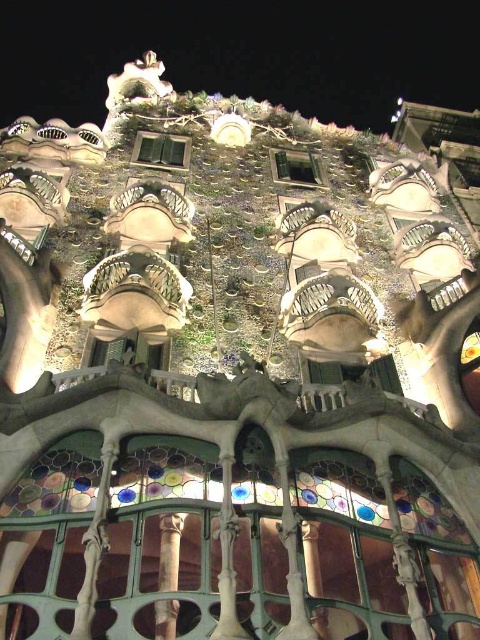
You are a drone operator tasked with capturing aerial footage of the Casa Batll? building. Your drone is currently positioned 100 meters away from the brown wood column at center. Can your drone safely fly towards the clear glass window at upper center without getting too close to the building?

The distance between the brown wood column at center and the clear glass window at upper center is 85.33 meters. Since your drone is currently 100 meters away from the brown wood column at center, it has enough space to safely fly towards the clear glass window at upper center without getting too close to the building.

You are a tourist standing in front of Casa Batll? at night. You want to take a photo of the matte glass window at center. Where should you aim your camera to capture it?

You should aim your camera at point (160, 150) to capture the matte glass window at center.

Looking at this image, you are standing in front of Casa Batll? looking up at the upper portion of the building. You see a point marked at coordinates (169, 550). What object is located at that point?

The point at coordinates (169, 550) indicates a brown wood column at center.